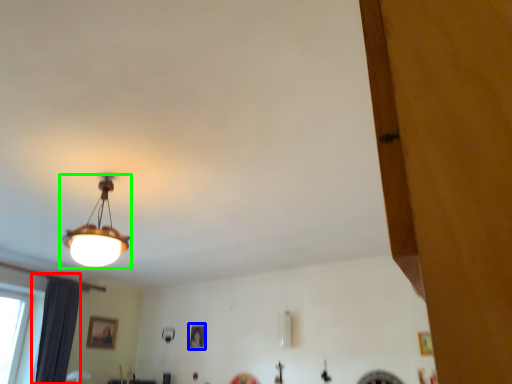
Question: Which object is the closest to the curtain (highlighted by a red box)? Choose among these: picture frame (highlighted by a blue box) or lamp (highlighted by a green box).

Choices:
 (A) picture frame
 (B) lamp

Answer: (A)